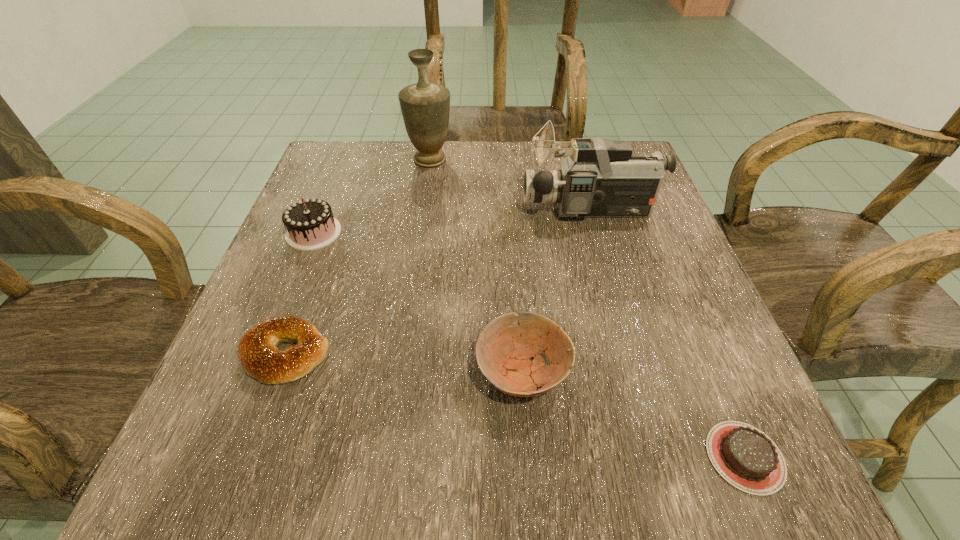
In the image, there is a desktop. Where is `vacant space at the far left corner`? The width and height of the screenshot is (960, 540). vacant space at the far left corner is located at coordinates (330, 166).

Locate an element on the screen. The image size is (960, 540). free space at the near left corner is located at coordinates (207, 470).

Identify the location of vacant space at the near right corner of the desktop. The image size is (960, 540). (723, 486).

You are a GUI agent. You are given a task and a screenshot of the screen. Output one action in this format:
    pyautogui.click(x=<x>, y=<y>)
    Task: Click on the unoccupied position between the fifth shortest object and the fourth tallest object
    This screenshot has width=960, height=540.
    Given the screenshot: What is the action you would take?
    pyautogui.click(x=557, y=291)

This screenshot has width=960, height=540. Find the location of `free space between the third shortest object and the right chocolate cake`. free space between the third shortest object and the right chocolate cake is located at coordinates (634, 415).

The width and height of the screenshot is (960, 540). In order to click on free spot between the bowl and the nearer chocolate cake in this screenshot , I will do `click(634, 415)`.

Identify the location of free space that is in between the taller chocolate cake and the fifth tallest object. Image resolution: width=960 pixels, height=540 pixels. pos(300,293).

Where is `free spot between the camcorder and the right chocolate cake`? This screenshot has height=540, width=960. free spot between the camcorder and the right chocolate cake is located at coordinates (667, 333).

You are a GUI agent. You are given a task and a screenshot of the screen. Output one action in this format:
    pyautogui.click(x=<x>, y=<y>)
    Task: Click on the free space between the bagel and the fifth shortest object
    
    Given the screenshot: What is the action you would take?
    pyautogui.click(x=439, y=281)

Where is `vacant region between the fifth shortest object and the third object from left to right`? vacant region between the fifth shortest object and the third object from left to right is located at coordinates point(511,185).